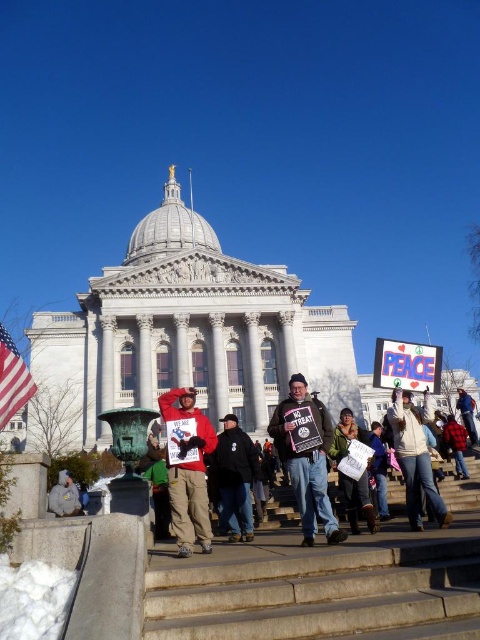
Question: Which point is closer to the camera?

Choices:
 (A) dark blue jacket at center
 (B) brown leather jacket at center
 (C) white paper sign at center
 (D) gray fabric bag at lower left

Answer: (B)

Question: Which object is closer to the camera taking this photo?

Choices:
 (A) brown leather jacket at center
 (B) dark blue jacket at center
 (C) white cotton shirt at center

Answer: (A)

Question: Does red fleece jacket at center have a lesser width compared to gray fabric bag at lower left?

Choices:
 (A) yes
 (B) no

Answer: (B)

Question: Is brown leather jacket at center to the right of white cotton shirt at center from the viewer's perspective?

Choices:
 (A) no
 (B) yes

Answer: (A)

Question: Does brown leather jacket at center lie behind white paper sign at center?

Choices:
 (A) yes
 (B) no

Answer: (B)

Question: Which point is closer to the camera taking this photo?

Choices:
 (A) (251, 444)
 (B) (4, 388)
 (C) (75, 506)
 (D) (468, 396)

Answer: (B)